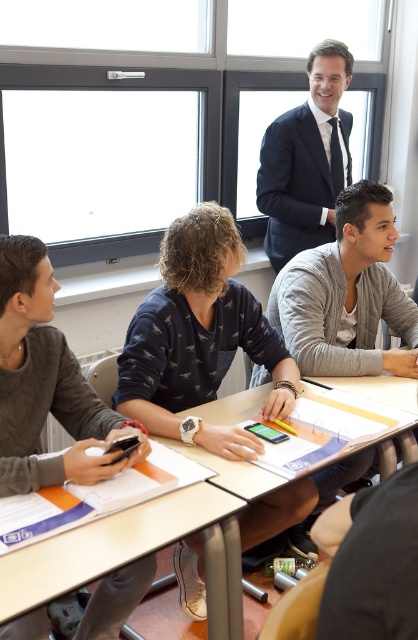
You are standing in the classroom and want to reach both the point at coordinates (x=0, y=568) and the point at coordinates (x=377, y=376). Which point should you approach first to minimize the distance you walk?

You should approach point (x=0, y=568) first because it is closer to you than point (x=377, y=376).

You are a student who needs to place a 12 inch notebook on the desk. Can the notebook fit between the dark blue sweater at center and the wooden desk at center?

The dark blue sweater at center and wooden desk at center are 15.79 inches apart. Since the notebook is 12 inches long, it can fit between them as the distance is greater than the notebook length.